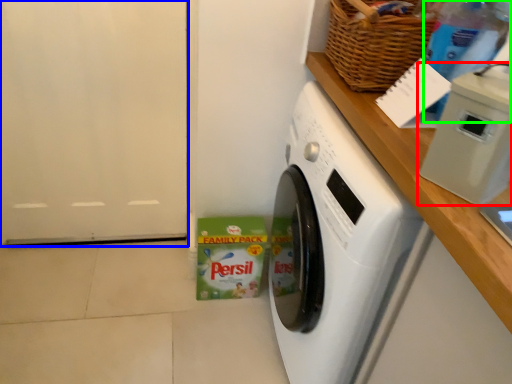
Question: Based on their relative distances, which object is farther from appliance (highlighted by a red box)? Choose from door (highlighted by a blue box) and bottle (highlighted by a green box).

Choices:
 (A) door
 (B) bottle

Answer: (A)